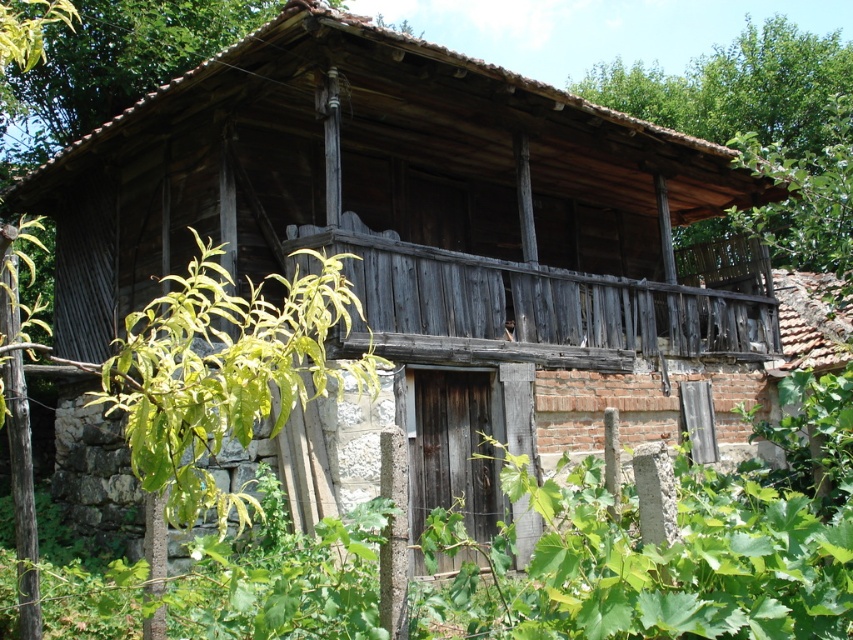
Who is positioned more to the left, green leafy plant at center or green leafy tree at upper right?

Positioned to the left is green leafy plant at center.

Who is more forward, (187, 602) or (802, 145)?

Positioned in front is point (187, 602).

Does point (685, 456) lie behind point (846, 141)?

No.

The image size is (853, 640). What are the coordinates of `green leafy plant at center` in the screenshot? It's located at (676, 552).